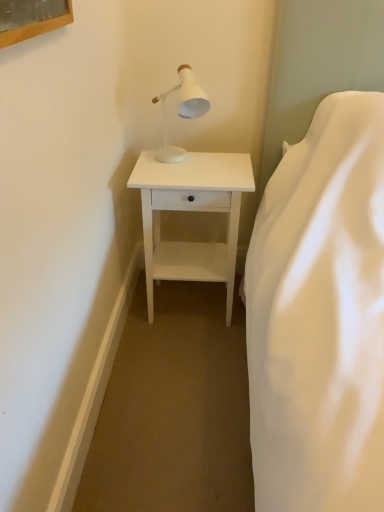
You are a GUI agent. You are given a task and a screenshot of the screen. Output one action in this format:
    pyautogui.click(x=<x>, y=<y>)
    Task: Click on the free space above white matte nightstand at lower center (from a real-world perspective)
    Image resolution: width=384 pixels, height=512 pixels.
    Given the screenshot: What is the action you would take?
    click(195, 165)